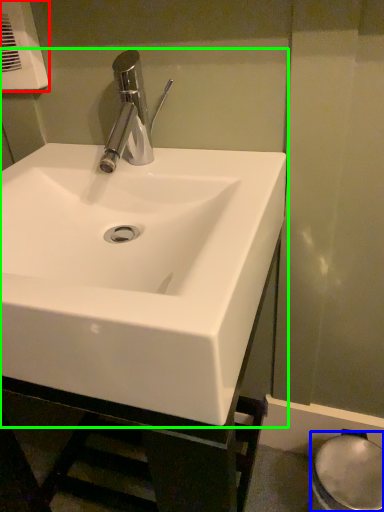
Question: Estimate the real-world distances between objects in this image. Which object is farther from hand dryer (highlighted by a red box), bidet (highlighted by a blue box) or sink (highlighted by a green box)?

Choices:
 (A) bidet
 (B) sink

Answer: (A)